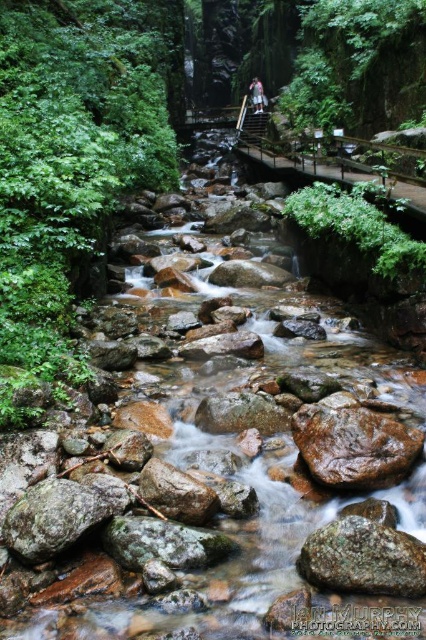
Is the position of brown rough rock at center more distant than that of smooth brown rock at center?

Yes.

Does brown rough rock at center have a smaller size compared to smooth brown rock at center?

No, brown rough rock at center is not smaller than smooth brown rock at center.

Identify the location of brown rough rock at center. This screenshot has width=426, height=640. (354, 444).

This screenshot has height=640, width=426. Find the location of `brown rough rock at center`. brown rough rock at center is located at coordinates (354, 444).

Is green mossy rock at lower left thinner than smooth gray rock at center?

Yes.

Between point (62, 502) and point (206, 419), which one is positioned in front?

Point (62, 502)

Is point (77, 499) farther from camera compared to point (239, 403)?

No.

Identify the location of green mossy rock at lower left. (62, 513).

Between point (353, 552) and point (232, 422), which one is positioned in front?

Point (353, 552)

Describe the element at coordinates (363, 557) in the screenshot. I see `rusty metallic rock at center` at that location.

This screenshot has height=640, width=426. What are the coordinates of `rusty metallic rock at center` in the screenshot? It's located at (363, 557).